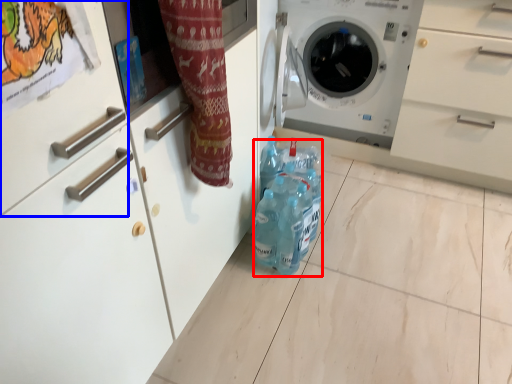
Question: Which point is closer to the camera, bottle (highlighted by a red box) or drawer (highlighted by a blue box)?

Choices:
 (A) bottle
 (B) drawer

Answer: (B)